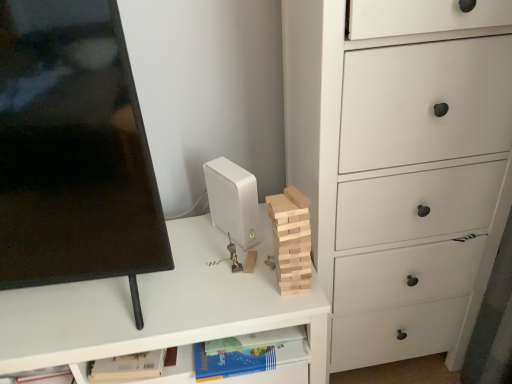
Describe the element at coordinates (158, 308) in the screenshot. This screenshot has width=512, height=384. I see `white matte desk at center` at that location.

What do you see at coordinates (291, 240) in the screenshot?
I see `natural wood block at center` at bounding box center [291, 240].

Image resolution: width=512 pixels, height=384 pixels. What do you see at coordinates (400, 166) in the screenshot?
I see `white matte chest of drawers at right` at bounding box center [400, 166].

At what (x,y) coordinates should I click in order to perform the action: click on white matte desktop computer at center. Please return your answer as a coordinate pair (x, y). The image size is (512, 384). Looking at the image, I should click on (233, 201).

Can you confirm if white matte desktop computer at center is thinner than blue paper book at lower center?

Answer: Yes, white matte desktop computer at center is thinner than blue paper book at lower center.

Based on the photo, would you say white matte desktop computer at center is outside blue paper book at lower center?

Yes, white matte desktop computer at center is located beyond the bounds of blue paper book at lower center.

Between point (229, 172) and point (217, 350), which one is positioned behind?

Positioned behind is point (229, 172).

Is white matte desk at center taller or shorter than blue paper book at lower center?

Clearly, white matte desk at center is taller compared to blue paper book at lower center.

Identify the location of book above the white matte desk at center (from the image's perspective). (242, 353).

From the picture: Who is smaller, white matte desk at center or blue paper book at lower center?

blue paper book at lower center is smaller.

Could blue paper book at lower center be considered to be inside white matte desk at center?

Yes, blue paper book at lower center is a part of white matte desk at center.

From a real-world perspective, relative to blue paper book at lower center, is natural wood block at center vertically above or below?

From a real-world perspective, natural wood block at center is physically above blue paper book at lower center.

From the image's perspective, which one is positioned higher, natural wood block at center or blue paper book at lower center?

natural wood block at center appears higher in the image.

Based on the photo, is natural wood block at center closer to the viewer compared to blue paper book at lower center?

Yes.

Considering the sizes of objects natural wood block at center and blue paper book at lower center in the image provided, who is bigger, natural wood block at center or blue paper book at lower center?

With larger size is blue paper book at lower center.

Does white matte desk at center touch natural wood block at center?

No.

Considering the sizes of objects white matte desk at center and natural wood block at center in the image provided, who is shorter, white matte desk at center or natural wood block at center?

natural wood block at center.

Which of these two, white matte desk at center or natural wood block at center, is thinner?

natural wood block at center is thinner.

In the scene shown: Looking at the image, does white matte desk at center seem bigger or smaller compared to natural wood block at center?

Clearly, white matte desk at center is larger in size than natural wood block at center.

Does blue paper book at lower center have a greater width compared to black glossy computer monitor at left?

Incorrect, the width of blue paper book at lower center does not surpass that of black glossy computer monitor at left.

Is blue paper book at lower center facing towards black glossy computer monitor at left?

No, blue paper book at lower center is not oriented towards black glossy computer monitor at left.

Which is correct: blue paper book at lower center is inside black glossy computer monitor at left, or outside of it?

The correct answer is: outside.

The height and width of the screenshot is (384, 512). Identify the location of computer monitor that is above the white matte desk at center (from the image's perspective). (73, 151).

From the image's perspective, does white matte desk at center appear higher than black glossy computer monitor at left?

Answer: Incorrect, from the image's perspective, white matte desk at center is lower than black glossy computer monitor at left.

Which object is further away from the camera, white matte desk at center or black glossy computer monitor at left?

white matte desk at center is more distant.

Is white matte desk at center far away from black glossy computer monitor at left?

No, white matte desk at center is not far away from black glossy computer monitor at left.

From the picture: Considering the positions of objects natural wood block at center and white matte chest of drawers at right in the image provided, who is more to the right, natural wood block at center or white matte chest of drawers at right?

white matte chest of drawers at right is more to the right.

Considering the sizes of objects natural wood block at center and white matte chest of drawers at right in the image provided, who is shorter, natural wood block at center or white matte chest of drawers at right?

natural wood block at center is shorter.

Is natural wood block at center facing towards white matte chest of drawers at right?

No, natural wood block at center does not turn towards white matte chest of drawers at right.

In the image, is natural wood block at center positioned in front of or behind white matte chest of drawers at right?

natural wood block at center is behind white matte chest of drawers at right.

There is a blue paper book at lower center. Identify the location of desktop computer above it (from a real-world perspective). Image resolution: width=512 pixels, height=384 pixels. (233, 201).

Locate an element on the screen. desk below the blue paper book at lower center (from a real-world perspective) is located at coordinates tap(158, 308).

When comparing their distances from blue paper book at lower center, does white matte desktop computer at center or white matte desk at center seem closer?

Based on the image, white matte desk at center appears to be nearer to blue paper book at lower center.

Estimate the real-world distances between objects in this image. Which object is further from white matte chest of drawers at right, white matte desktop computer at center or black glossy computer monitor at left?

Based on the image, black glossy computer monitor at left appears to be further to white matte chest of drawers at right.

Which object lies further to the anchor point white matte desktop computer at center, blue paper book at lower center or natural wood block at center?

Among the two, blue paper book at lower center is located further to white matte desktop computer at center.

Consider the image. Looking at the image, which one is located closer to white matte chest of drawers at right, white matte desk at center or natural wood block at center?

The object closer to white matte chest of drawers at right is natural wood block at center.

Based on their spatial positions, is natural wood block at center or blue paper book at lower center further from white matte chest of drawers at right?

blue paper book at lower center is positioned further to the anchor white matte chest of drawers at right.

Considering their positions, is white matte desk at center positioned further to blue paper book at lower center than white matte chest of drawers at right?

Based on the image, white matte chest of drawers at right appears to be further to blue paper book at lower center.

Considering their positions, is white matte desktop computer at center positioned closer to white matte desk at center than black glossy computer monitor at left?

white matte desktop computer at center is positioned closer to the anchor white matte desk at center.

When comparing their distances from blue paper book at lower center, does white matte desktop computer at center or white matte chest of drawers at right seem further?

white matte chest of drawers at right.

This screenshot has width=512, height=384. Identify the location of block between white matte desktop computer at center and blue paper book at lower center from top to bottom. (291, 240).

Find the location of a particular element. The image size is (512, 384). desktop computer located between white matte desk at center and white matte chest of drawers at right in the left-right direction is located at coordinates (233, 201).

The height and width of the screenshot is (384, 512). Identify the location of block between white matte desk at center and white matte chest of drawers at right. (291, 240).

Where is `book between black glossy computer monitor at left and white matte desk at center in the up-down direction`? book between black glossy computer monitor at left and white matte desk at center in the up-down direction is located at coordinates (242, 353).